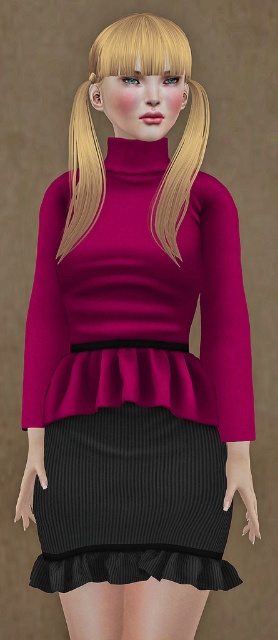
Question: Is matte pink sweater at center bigger than smooth beige tights at lower center?

Choices:
 (A) no
 (B) yes

Answer: (B)

Question: Does blonde silky hair at upper center lie in front of matte pink turtleneck at center?

Choices:
 (A) no
 (B) yes

Answer: (B)

Question: Which point appears closest to the camera in this image?

Choices:
 (A) (202, 205)
 (B) (145, 164)
 (C) (80, 618)

Answer: (C)

Question: Which object appears closest to the camera in this image?

Choices:
 (A) smooth beige tights at lower center
 (B) blonde silky hair at upper center
 (C) blonde silky hair at upper left

Answer: (A)

Question: Among these objects, which one is nearest to the camera?

Choices:
 (A) matte pink turtleneck at center
 (B) matte pink sweater at center
 (C) blonde silky hair at upper left
 (D) blonde silky hair at upper center

Answer: (B)

Question: Is smooth beige tights at lower center to the left of blonde silky hair at upper left from the viewer's perspective?

Choices:
 (A) no
 (B) yes

Answer: (A)